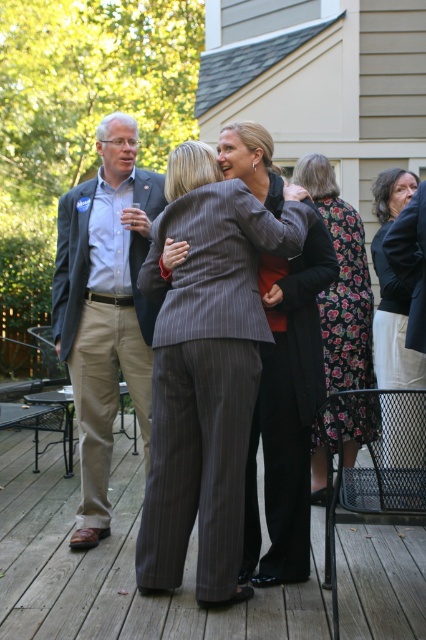
Question: Does pinstriped fabric suit at center appear over floral fabric dress at lower right?

Choices:
 (A) no
 (B) yes

Answer: (A)

Question: Which object appears farthest from the camera in this image?

Choices:
 (A) matte gray blazer at left
 (B) floral fabric dress at lower right

Answer: (B)

Question: Can you confirm if matte gray blazer at left is wider than floral fabric dress at lower right?

Choices:
 (A) no
 (B) yes

Answer: (B)

Question: Considering the real-world distances, which object is farthest from the gray pinstripe suit at center?

Choices:
 (A) floral dress at center
 (B) matte gray blazer at left

Answer: (B)

Question: From the image, what is the correct spatial relationship of matte gray blazer at left in relation to gray pinstripe suit at center?

Choices:
 (A) right
 (B) left

Answer: (B)

Question: Which point appears closest to the camera in this image?

Choices:
 (A) (396, 397)
 (B) (98, 230)

Answer: (A)